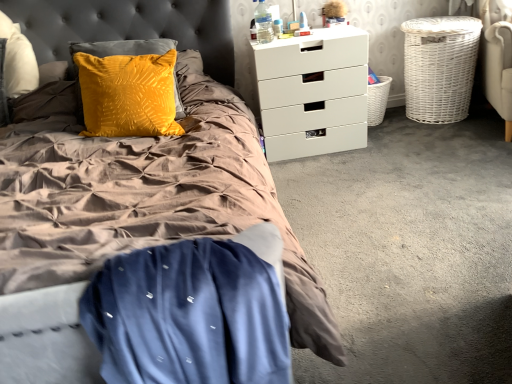
In order to click on vacant area on top of white wicker basket at right, positioned as the first basket in right-to-left order (from a real-world perspective) in this screenshot , I will do `click(435, 18)`.